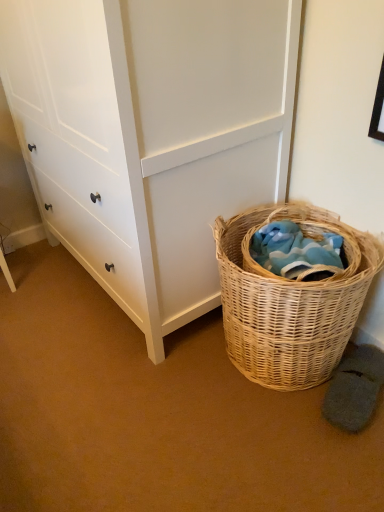
Measure the distance between point (180, 144) and camera.

They are 3.62 feet apart.

What do you see at coordinates (150, 135) in the screenshot?
I see `white matte chest of drawers at center` at bounding box center [150, 135].

Locate an element on the screen. This screenshot has height=512, width=384. white matte chest of drawers at center is located at coordinates (150, 135).

Locate an element on the screen. This screenshot has height=512, width=384. woven natural basket at lower right is located at coordinates (290, 300).

Describe the element at coordinates (290, 300) in the screenshot. I see `woven natural basket at lower right` at that location.

The height and width of the screenshot is (512, 384). I want to click on white matte chest of drawers at center, so click(x=150, y=135).

Does white matte chest of drawers at center appear on the right side of woven natural basket at lower right?

No, white matte chest of drawers at center is not to the right of woven natural basket at lower right.

Which object is more forward, white matte chest of drawers at center or woven natural basket at lower right?

white matte chest of drawers at center is closer to the camera.

Between point (124, 53) and point (357, 310), which one is positioned in front?

The point (124, 53) is in front.

From the image's perspective, is white matte chest of drawers at center above woven natural basket at lower right?

Yes, from the image's perspective, white matte chest of drawers at center is above woven natural basket at lower right.

From a real-world perspective, between white matte chest of drawers at center and woven natural basket at lower right, who is vertically higher?

white matte chest of drawers at center, from a real-world perspective.

Can you confirm if white matte chest of drawers at center is thinner than woven natural basket at lower right?

No, white matte chest of drawers at center is not thinner than woven natural basket at lower right.

Can you confirm if white matte chest of drawers at center is shorter than woven natural basket at lower right?

No, white matte chest of drawers at center is not shorter than woven natural basket at lower right.

Can you confirm if white matte chest of drawers at center is smaller than woven natural basket at lower right?

Incorrect, white matte chest of drawers at center is not smaller in size than woven natural basket at lower right.

Could woven natural basket at lower right be considered to be inside white matte chest of drawers at center?

No, woven natural basket at lower right is not inside white matte chest of drawers at center.

Are white matte chest of drawers at center and woven natural basket at lower right located far from each other?

No, white matte chest of drawers at center is not far from woven natural basket at lower right.

Consider the image. Is woven natural basket at lower right at the back of white matte chest of drawers at center?

No, white matte chest of drawers at center is not facing the opposite direction of woven natural basket at lower right.

What's the angular difference between white matte chest of drawers at center and woven natural basket at lower right's facing directions?

white matte chest of drawers at center and woven natural basket at lower right are facing 0.287 degrees away from each other.

How distant is white matte chest of drawers at center from woven natural basket at lower right?

A distance of 13.48 inches exists between white matte chest of drawers at center and woven natural basket at lower right.

Locate an element on the screen. picnic basket below the white matte chest of drawers at center (from a real-world perspective) is located at coordinates (290, 300).

Which object is positioned more to the left, woven natural basket at lower right or white matte chest of drawers at center?

white matte chest of drawers at center.

Is the depth of woven natural basket at lower right greater than that of white matte chest of drawers at center?

Yes, woven natural basket at lower right is behind white matte chest of drawers at center.

Considering the positions of point (247, 370) and point (19, 42), is point (247, 370) closer or farther from the camera than point (19, 42)?

Point (247, 370) is positioned closer to the camera compared to point (19, 42).

From the image's perspective, which object appears higher, woven natural basket at lower right or white matte chest of drawers at center?

From the image's view, white matte chest of drawers at center is above.

From a real-world perspective, who is located lower, woven natural basket at lower right or white matte chest of drawers at center?

woven natural basket at lower right is physically lower.

Which object is thinner, woven natural basket at lower right or white matte chest of drawers at center?

With smaller width is woven natural basket at lower right.

Considering the sizes of objects woven natural basket at lower right and white matte chest of drawers at center in the image provided, who is shorter, woven natural basket at lower right or white matte chest of drawers at center?

Standing shorter between the two is woven natural basket at lower right.

Based on their sizes in the image, would you say woven natural basket at lower right is bigger or smaller than white matte chest of drawers at center?

woven natural basket at lower right is smaller than white matte chest of drawers at center.

Would you say woven natural basket at lower right is inside or outside white matte chest of drawers at center?

woven natural basket at lower right is outside white matte chest of drawers at center.

In the scene shown: Is woven natural basket at lower right not near white matte chest of drawers at center?

No, woven natural basket at lower right is not far away from white matte chest of drawers at center.

Is white matte chest of drawers at center at the back of woven natural basket at lower right?

No, white matte chest of drawers at center is not at the back of woven natural basket at lower right.

How different are the orientations of woven natural basket at lower right and white matte chest of drawers at center in degrees?

The angle between the facing direction of woven natural basket at lower right and the facing direction of white matte chest of drawers at center is 0.287 degrees.

How much distance is there between woven natural basket at lower right and white matte chest of drawers at center?

13.48 inches.

This screenshot has width=384, height=512. I want to click on picnic basket that is on the right side of white matte chest of drawers at center, so click(x=290, y=300).

Where is `the chest of drawers in front of the woven natural basket at lower right`? This screenshot has width=384, height=512. the chest of drawers in front of the woven natural basket at lower right is located at coordinates (150, 135).

You are a GUI agent. You are given a task and a screenshot of the screen. Output one action in this format:
    pyautogui.click(x=<x>, y=<y>)
    Task: Click on the picnic basket located behind the white matte chest of drawers at center
    Image resolution: width=384 pixels, height=512 pixels.
    Given the screenshot: What is the action you would take?
    pyautogui.click(x=290, y=300)